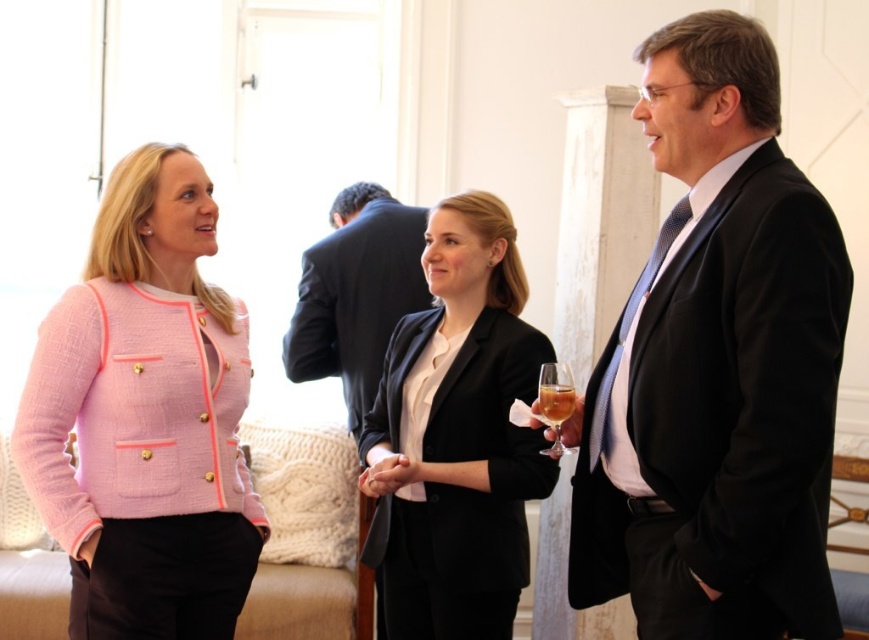
Image resolution: width=869 pixels, height=640 pixels. What do you see at coordinates (356, 292) in the screenshot? I see `dark suit jacket at center` at bounding box center [356, 292].

Is dark suit jacket at center wider than translucent glass at right?

Yes.

Which is in front, point (314, 332) or point (541, 376)?

Point (541, 376) is in front.

Where is `dark suit jacket at center`? dark suit jacket at center is located at coordinates (356, 292).

Between matte black blazer at center and translucent glass at right, which one has more height?

Standing taller between the two is matte black blazer at center.

Can you confirm if matte black blazer at center is positioned to the right of translucent glass at right?

Incorrect, matte black blazer at center is not on the right side of translucent glass at right.

Identify the location of matte black blazer at center. (456, 436).

Is matte black suit at right below dark suit jacket at center?

Yes.

From the picture: Does matte black suit at right have a smaller size compared to dark suit jacket at center?

No, matte black suit at right is not smaller than dark suit jacket at center.

Is point (647, 472) farther from viewer compared to point (317, 272)?

No, (647, 472) is in front of (317, 272).

Identify the location of matte black suit at right. The width and height of the screenshot is (869, 640). (715, 368).